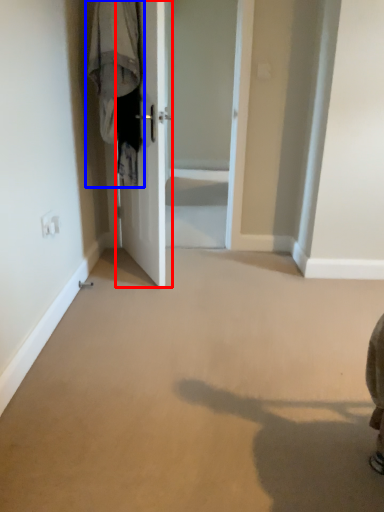
Question: Among these objects, which one is nearest to the camera, door (highlighted by a red box) or laundry (highlighted by a blue box)?

Choices:
 (A) door
 (B) laundry

Answer: (A)